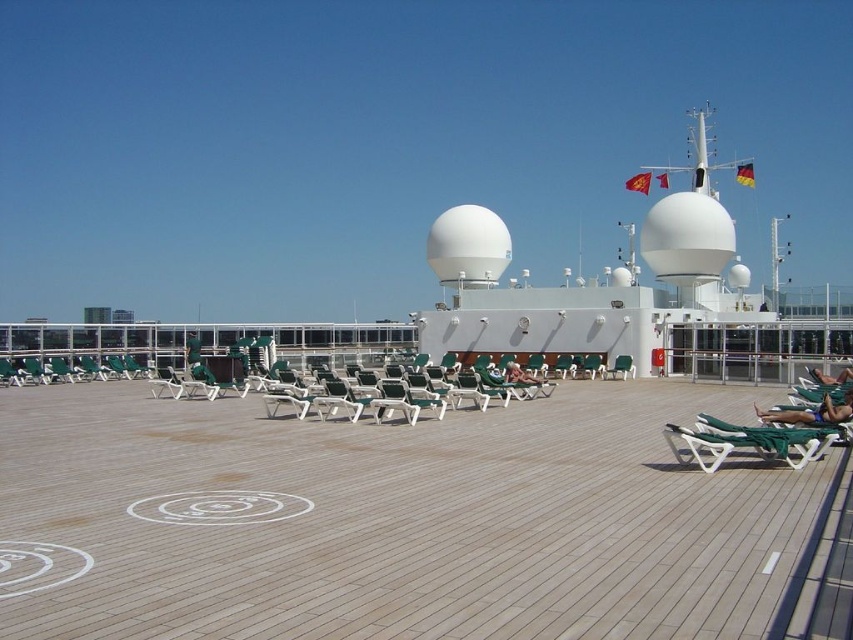
You are standing at the point marked by the coordinates (747, 442) on the cruise ship deck. Looking around, you see the green fabric beach chair at lower right. Can you tell me which direction the green fabric beach chair at lower right is relative to your current position?

The green fabric beach chair at lower right is located exactly at your current position at point (747, 442), so you are standing right on top of it.

You are standing on the cruise ship deck and want to take a photo of the point at coordinate (773, 452). If your camera has a maximum focus range of 12 meters, will it be able to focus on the point?

The point at coordinate (773, 452) is 12.35 meters away from the camera, which exceeds the maximum focus range of 12 meters. Therefore, the camera cannot focus on the point.

You are a passenger on the cruise ship and want to sit on one of the chairs at the center of the deck. You have a large backpack that requires extra space. Which chair between the green fabric chair at center and the green plastic beach chair at center would you choose?

The green fabric chair at center has a greater width than the green plastic beach chair at center, so you should choose the green fabric chair at center to accommodate your large backpack.